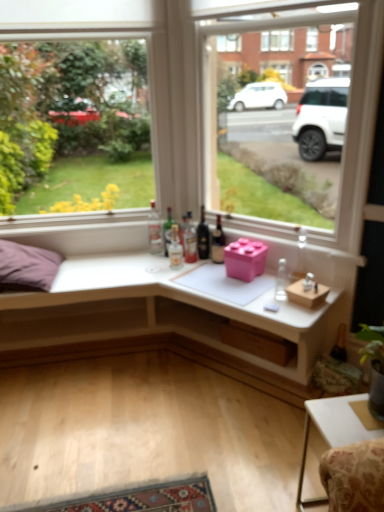
Identify the location of free space in front of clear glass bottle at center, which appears as the first bottle when viewed from the left. This screenshot has height=512, width=384. (148, 263).